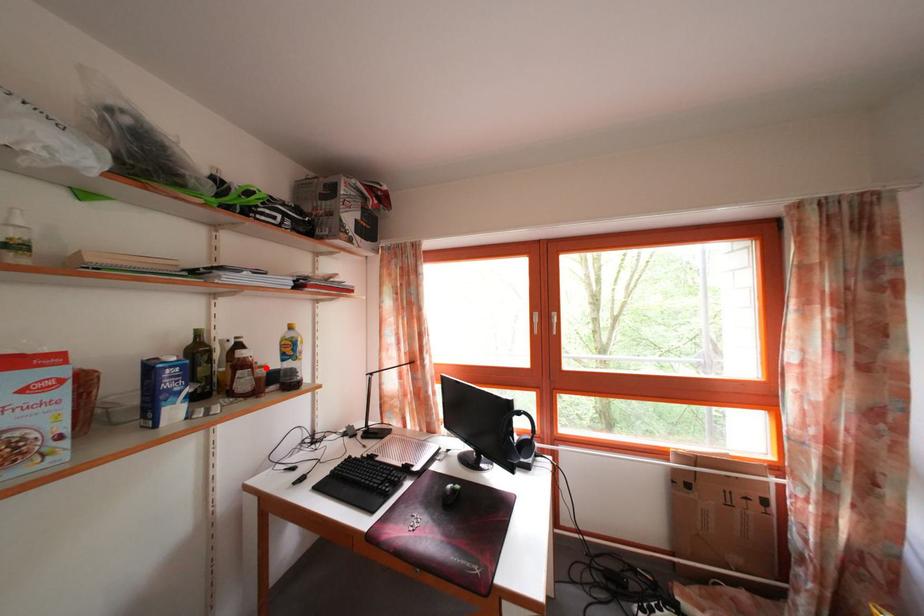
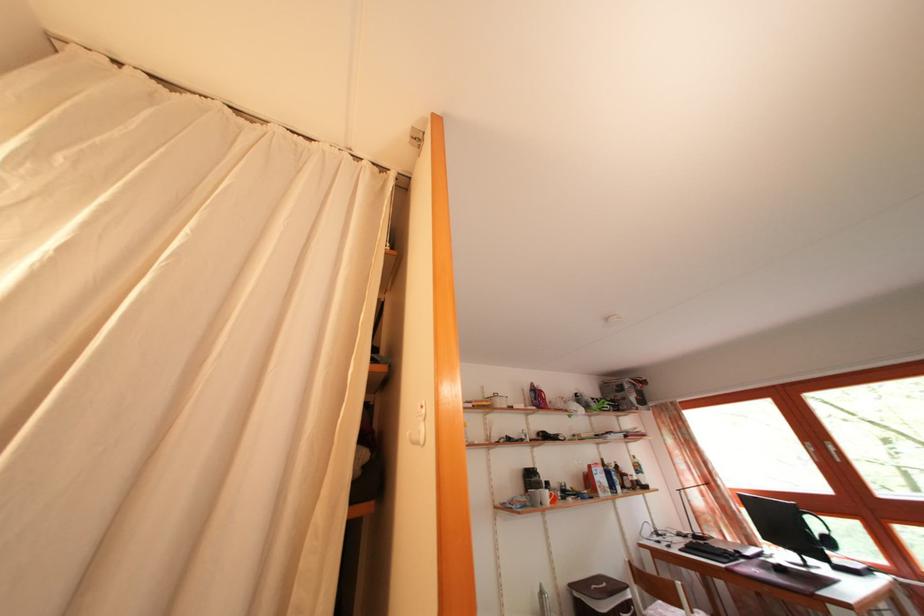
Where in the second image is the point corresponding to the highlighted location from the first image?

(636, 480)